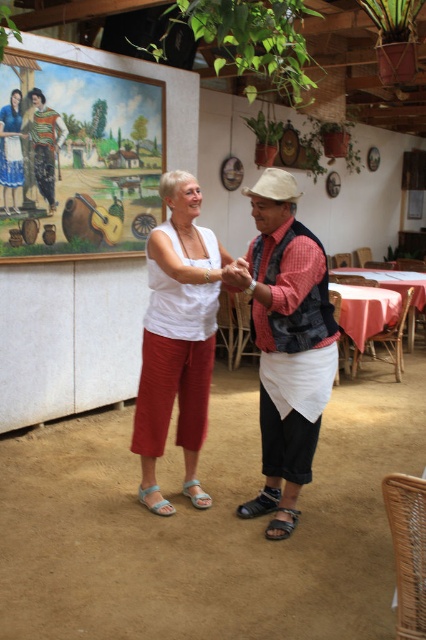
Question: Which point appears closest to the camera in this image?

Choices:
 (A) (233, 273)
 (B) (11, 141)

Answer: (A)

Question: Which of the following is the farthest from the observer?

Choices:
 (A) (14, 113)
 (B) (187, 301)
 (C) (261, 404)

Answer: (A)

Question: Is white cotton tank top at center to the left of brown leather sandal at lower center from the viewer's perspective?

Choices:
 (A) no
 (B) yes

Answer: (B)

Question: Does white cotton tank top at center have a smaller size compared to brown leather sandal at lower center?

Choices:
 (A) yes
 (B) no

Answer: (B)

Question: Does matte red vest at center have a smaller size compared to matte white blouse at center?

Choices:
 (A) yes
 (B) no

Answer: (B)

Question: Which is farther from the light gray fabric sandal at lower left?

Choices:
 (A) matte red vest at center
 (B) white cotton tank top at center
 (C) matte white blouse at center
 (D) brown leather sandal at lower center

Answer: (C)